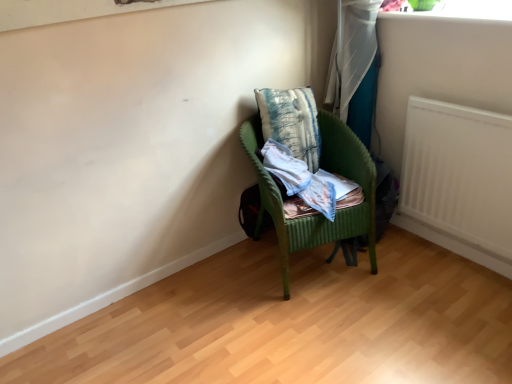
Where is `vacant space situated on the left part of green wicker chair at center`? vacant space situated on the left part of green wicker chair at center is located at coordinates (218, 283).